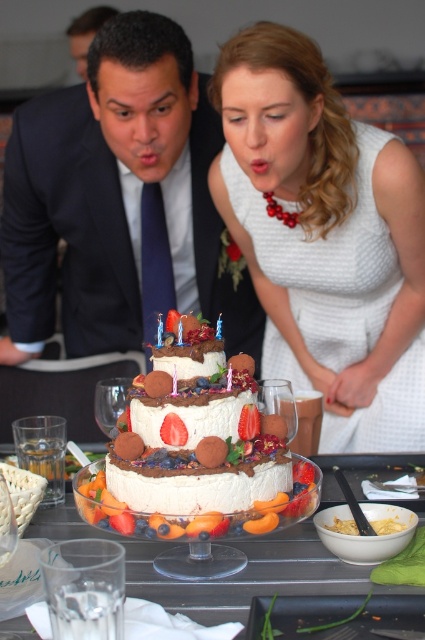
Question: Which is farther from the white frosted cake at center?

Choices:
 (A) white textured dress at center
 (B) matte white dress at center
 (C) white glossy cake at center

Answer: (B)

Question: Is white textured dress at center thinner than white frosted cake at center?

Choices:
 (A) yes
 (B) no

Answer: (B)

Question: Does white frosted cake at center come behind white glossy cake at center?

Choices:
 (A) no
 (B) yes

Answer: (B)

Question: Which point is farther from the camera taking this photo?

Choices:
 (A) (172, 609)
 (B) (246, 424)
 (C) (180, 118)
 (D) (274, 333)

Answer: (D)

Question: Is matte white dress at center wider than white frosted cake at center?

Choices:
 (A) yes
 (B) no

Answer: (A)

Question: Which point is closer to the camera?

Choices:
 (A) white textured dress at center
 (B) white frosted cake at center
 (C) white glossy cake at center
 (D) matte white dress at center

Answer: (C)